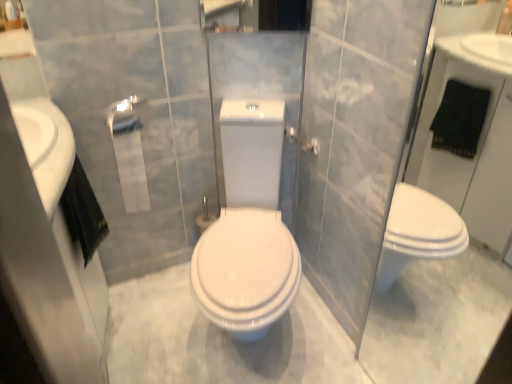
Question: Does white matte toilet paper at center appear on the left side of white glossy sink at left?

Choices:
 (A) no
 (B) yes

Answer: (A)

Question: From the image's perspective, would you say white matte toilet paper at center is positioned over white glossy sink at left?

Choices:
 (A) yes
 (B) no

Answer: (A)

Question: Is white matte toilet paper at center bigger than white glossy sink at left?

Choices:
 (A) no
 (B) yes

Answer: (A)

Question: From the image's perspective, would you say white matte toilet paper at center is shown under white glossy sink at left?

Choices:
 (A) yes
 (B) no

Answer: (B)

Question: Is the position of white matte toilet paper at center more distant than that of white glossy sink at left?

Choices:
 (A) yes
 (B) no

Answer: (A)

Question: Does white matte toilet paper at center have a smaller size compared to white glossy sink at left?

Choices:
 (A) no
 (B) yes

Answer: (B)

Question: Is transparent glass door at right further to the viewer compared to silver metallic towel bar at upper center?

Choices:
 (A) no
 (B) yes

Answer: (A)

Question: Is transparent glass door at right wider than silver metallic towel bar at upper center?

Choices:
 (A) yes
 (B) no

Answer: (B)

Question: Is transparent glass door at right closer to camera compared to silver metallic towel bar at upper center?

Choices:
 (A) yes
 (B) no

Answer: (A)

Question: Can silver metallic towel bar at upper center be found inside transparent glass door at right?

Choices:
 (A) no
 (B) yes

Answer: (A)

Question: From the image's perspective, is transparent glass door at right over silver metallic towel bar at upper center?

Choices:
 (A) yes
 (B) no

Answer: (B)

Question: Considering the relative sizes of transparent glass door at right and silver metallic towel bar at upper center in the image provided, is transparent glass door at right taller than silver metallic towel bar at upper center?

Choices:
 (A) yes
 (B) no

Answer: (A)

Question: Is white glossy sink at left positioned behind transparent glass door at right?

Choices:
 (A) no
 (B) yes

Answer: (B)